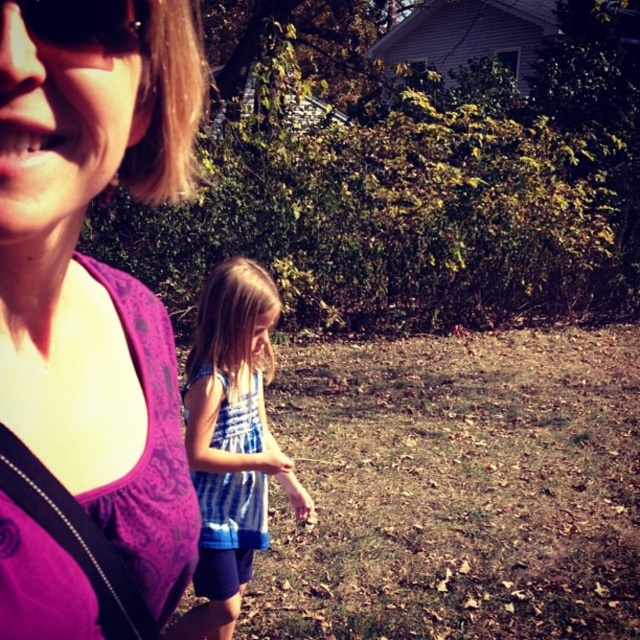
You are a photographer trying to capture the purple fabric at upper left and the matte black sunglasses at upper left in a single shot. Since both are in the upper left, can you tell me which one is closer to the bottom of the frame?

The purple fabric at upper left is located below matte black sunglasses at upper left, so it is closer to the bottom of the frame.

From the picture: You are an artist trying to sketch the scene. You want to place the purple fabric at upper left accurately. What are the coordinates for its position?

The coordinates for the purple fabric at upper left are at point (90, 317).

In the scene shown: You are a photographer trying to capture a photo of the blue striped dress at center and the matte black sunglasses at upper left. If you want to ensure both items are fully visible in the frame, which one should you focus on first to avoid cropping?

The blue striped dress at center is wider than the matte black sunglasses at upper left, so you should focus on the blue striped dress at center first to ensure it fits in the frame before adjusting for the matte black sunglasses at upper left.